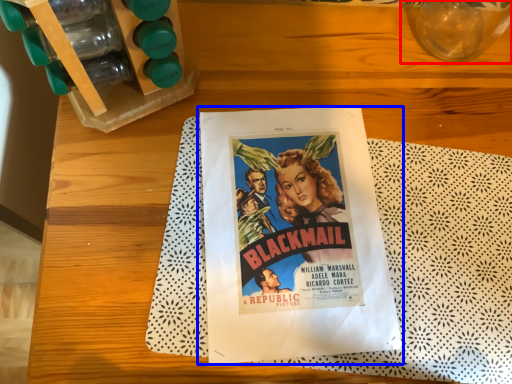
Question: Which object is closer to the camera taking this photo, glass vase (highlighted by a red box) or paperback book (highlighted by a blue box)?

Choices:
 (A) glass vase
 (B) paperback book

Answer: (A)